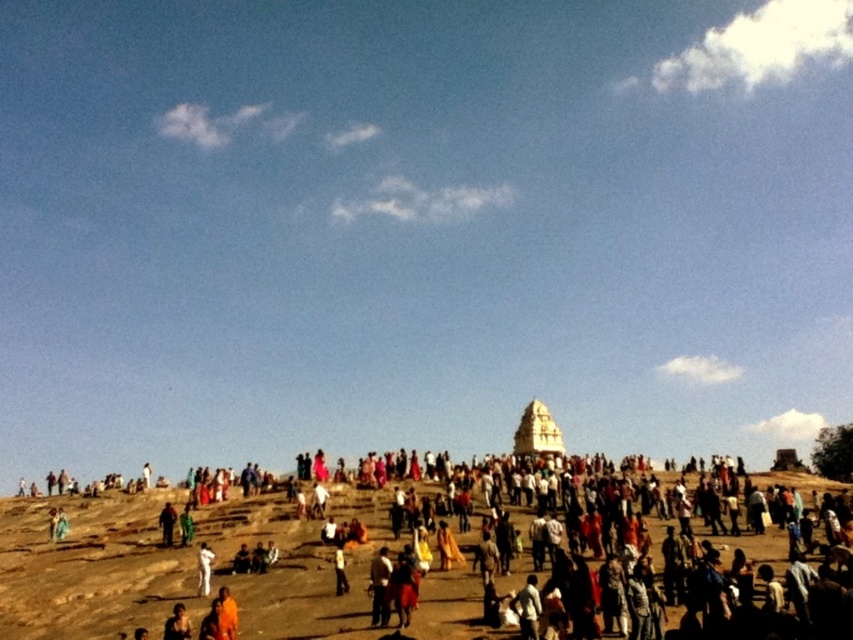
Question: From the image, what is the correct spatial relationship of white stone pyramid at center in relation to orange fabric person at center?

Choices:
 (A) right
 (B) left

Answer: (A)

Question: Is white stone pyramid at center below white fabric person at lower center?

Choices:
 (A) no
 (B) yes

Answer: (B)

Question: Which point is farther to the camera?

Choices:
 (A) (254, 602)
 (B) (175, 520)
 (C) (201, 547)
 (D) (534, 444)

Answer: (D)

Question: Which of the following is the closest to the observer?

Choices:
 (A) (166, 532)
 (B) (206, 548)

Answer: (B)

Question: Which object is the closest to the dark green fabric at lower left?

Choices:
 (A) brown sandy ground at center
 (B) orange fabric person at center
 (C) white stone pyramid at center

Answer: (B)

Question: Does white stone pyramid at center have a smaller size compared to white fabric person at lower center?

Choices:
 (A) yes
 (B) no

Answer: (B)